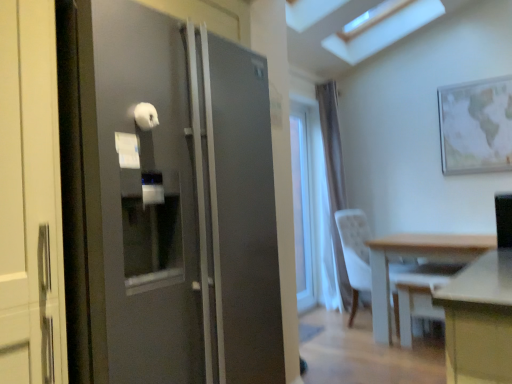
Question: Is the position of clear glass window at center less distant than that of white plastic swivel chair at lower right?

Choices:
 (A) no
 (B) yes

Answer: (A)

Question: Does clear glass window at center touch white plastic swivel chair at lower right?

Choices:
 (A) yes
 (B) no

Answer: (B)

Question: Can you confirm if clear glass window at center is smaller than white plastic swivel chair at lower right?

Choices:
 (A) yes
 (B) no

Answer: (A)

Question: From a real-world perspective, does clear glass window at center sit lower than white plastic swivel chair at lower right?

Choices:
 (A) yes
 (B) no

Answer: (B)

Question: Is white plastic swivel chair at lower right at the back of clear glass window at center?

Choices:
 (A) no
 (B) yes

Answer: (A)

Question: From the image's perspective, is white sheer curtain at center above or below white fabric chair at right?

Choices:
 (A) below
 (B) above

Answer: (B)

Question: In terms of width, does white sheer curtain at center look wider or thinner when compared to white fabric chair at right?

Choices:
 (A) thin
 (B) wide

Answer: (A)

Question: Is white sheer curtain at center taller or shorter than white fabric chair at right?

Choices:
 (A) tall
 (B) short

Answer: (A)

Question: Considering their positions, is white sheer curtain at center located in front of or behind white fabric chair at right?

Choices:
 (A) front
 (B) behind

Answer: (B)

Question: Based on their sizes in the image, would you say white plastic swivel chair at lower right is bigger or smaller than clear glass window at center?

Choices:
 (A) small
 (B) big

Answer: (B)

Question: Considering the relative positions of white plastic swivel chair at lower right and clear glass window at center in the image provided, is white plastic swivel chair at lower right to the left or to the right of clear glass window at center?

Choices:
 (A) right
 (B) left

Answer: (A)

Question: Considering the positions of point (430, 291) and point (303, 304), is point (430, 291) closer or farther from the camera than point (303, 304)?

Choices:
 (A) farther
 (B) closer

Answer: (B)

Question: Choose the correct answer: Is white plastic swivel chair at lower right inside clear glass window at center or outside it?

Choices:
 (A) outside
 (B) inside

Answer: (A)

Question: Is light wood table at lower right taller or shorter than clear glass window at center?

Choices:
 (A) short
 (B) tall

Answer: (A)

Question: Is light wood table at lower right inside or outside of clear glass window at center?

Choices:
 (A) inside
 (B) outside

Answer: (B)